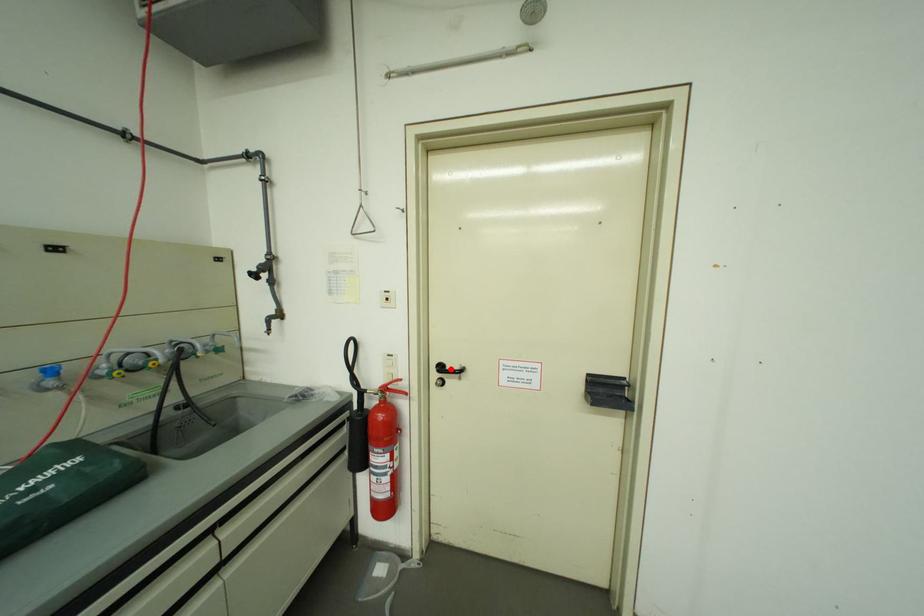
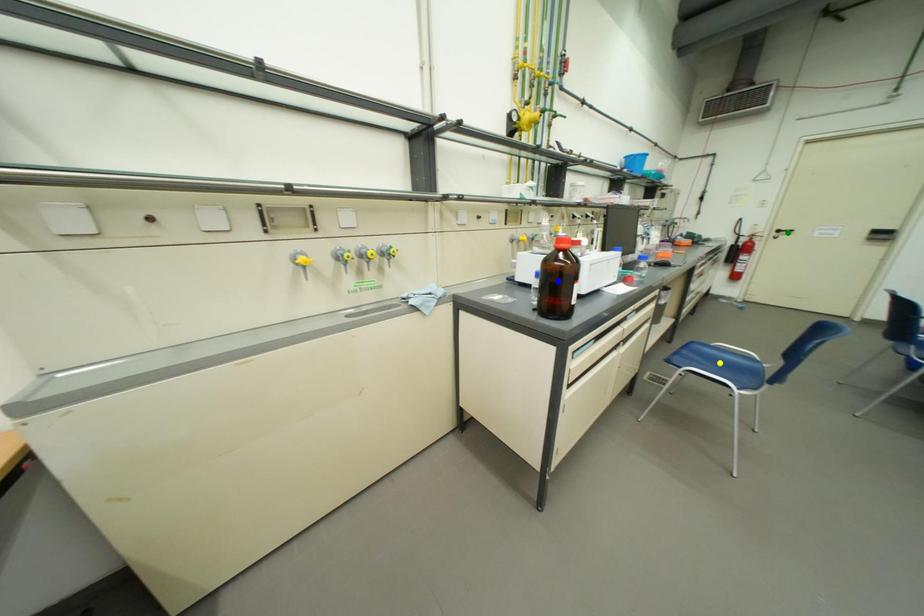
Question: I am providing you with two images of the same scene from different viewpoints. A red point is marked on the first image. You are given multiple points on the second image. Which mark in image 2 goes with the point in image 1?

Choices:
 (A) blue point
 (B) green point
 (C) yellow point

Answer: (B)